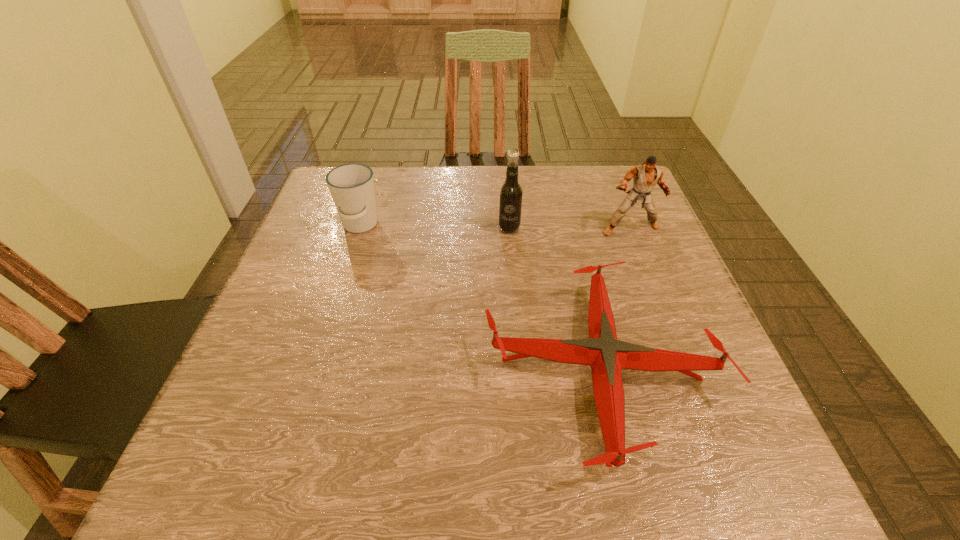
Locate an element on the screen. blank space at the right edge of the desktop is located at coordinates (672, 394).

This screenshot has height=540, width=960. What are the coordinates of `vacant space at the far right corner of the desktop` in the screenshot? It's located at (x=619, y=176).

The width and height of the screenshot is (960, 540). In order to click on vacant space that is in between the root beer and the puncher in this screenshot , I will do `click(570, 228)`.

Locate an element on the screen. vacant region between the nearest object and the third tallest object is located at coordinates (480, 298).

Find the location of a particular element. This screenshot has height=540, width=960. free space between the third tallest object and the puncher is located at coordinates (495, 227).

The height and width of the screenshot is (540, 960). I want to click on free area in between the puncher and the root beer, so click(x=570, y=228).

Where is `vacant area that lies between the puncher and the root beer`? The image size is (960, 540). vacant area that lies between the puncher and the root beer is located at coordinates (570, 228).

Locate an element on the screen. Image resolution: width=960 pixels, height=540 pixels. vacant space that is in between the root beer and the puncher is located at coordinates (570, 228).

Where is `vacant area that lies between the root beer and the leftmost object`? The image size is (960, 540). vacant area that lies between the root beer and the leftmost object is located at coordinates (435, 227).

The height and width of the screenshot is (540, 960). Find the location of `unoccupied position between the root beer and the nearest object`. unoccupied position between the root beer and the nearest object is located at coordinates (555, 299).